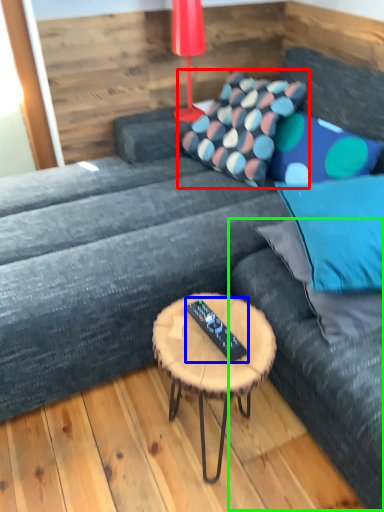
Question: Based on their relative distances, which object is nearer to pillow (highlighted by a red box)? Choose from remote (highlighted by a blue box) and bean bag chair (highlighted by a green box).

Choices:
 (A) remote
 (B) bean bag chair

Answer: (B)